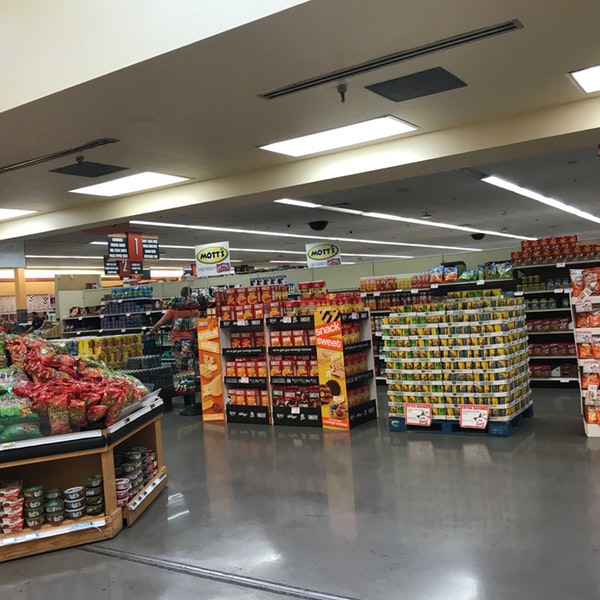
Image resolution: width=600 pixels, height=600 pixels. Find the location of `store display`. store display is located at coordinates 270,378, 463,380, 596,328.